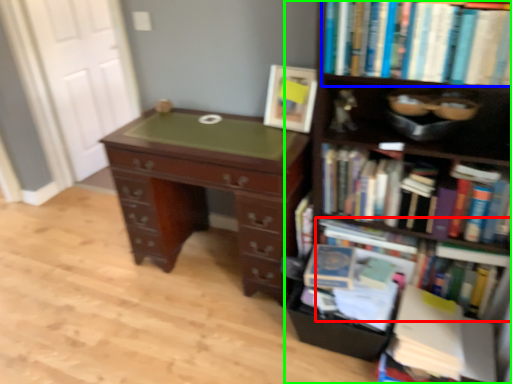
Question: Which object is positioned farthest from book (highlighted by a red box)? Select from book (highlighted by a blue box) and bookcase (highlighted by a green box).

Choices:
 (A) book
 (B) bookcase

Answer: (A)